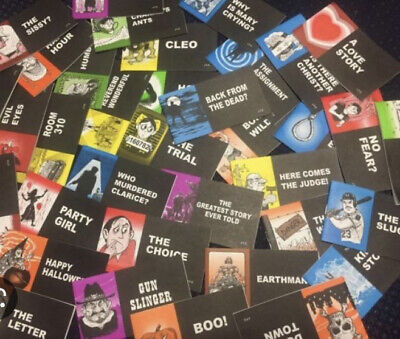
The width and height of the screenshot is (400, 339). In order to click on surface in this screenshot , I will do `click(376, 23)`.